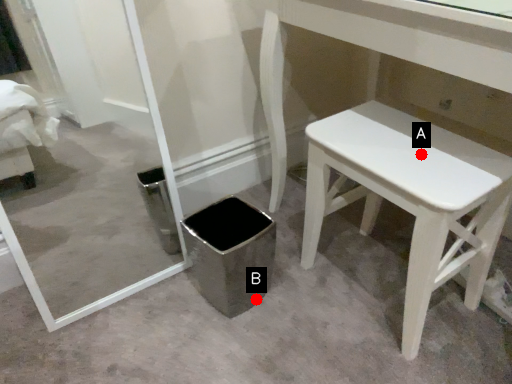
Question: Two points are circled on the image, labeled by A and B beside each circle. Which point is farther to the camera?

Choices:
 (A) A is further
 (B) B is further

Answer: (B)